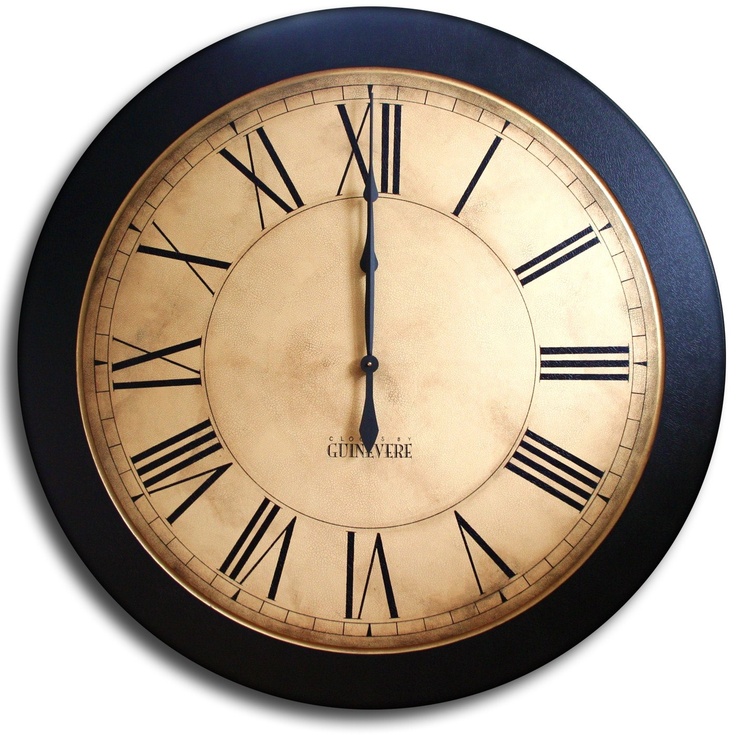
This screenshot has height=735, width=736. What are the coordinates of `clock hand` in the screenshot? It's located at (372, 268).